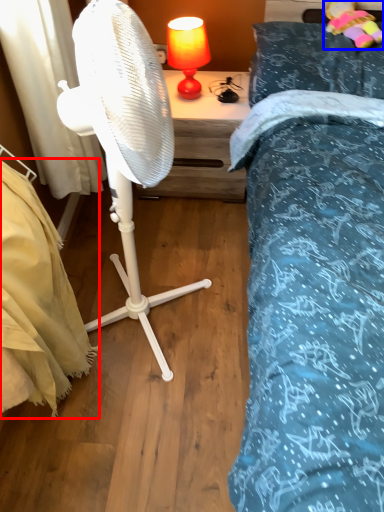
Question: Which of the following is the closest to the observer, mattress (highlighted by a red box) or toy (highlighted by a blue box)?

Choices:
 (A) mattress
 (B) toy

Answer: (A)